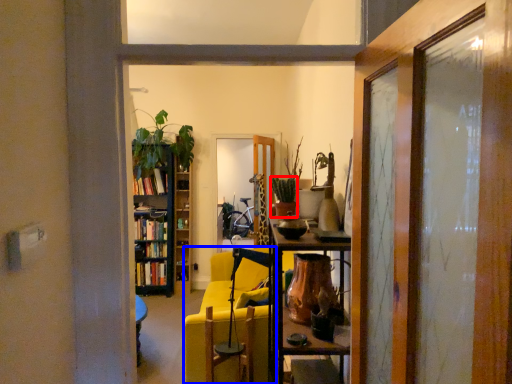
Question: Which of the following is the farthest to the observer, houseplant (highlighted by a red box) or chair (highlighted by a blue box)?

Choices:
 (A) houseplant
 (B) chair

Answer: (B)